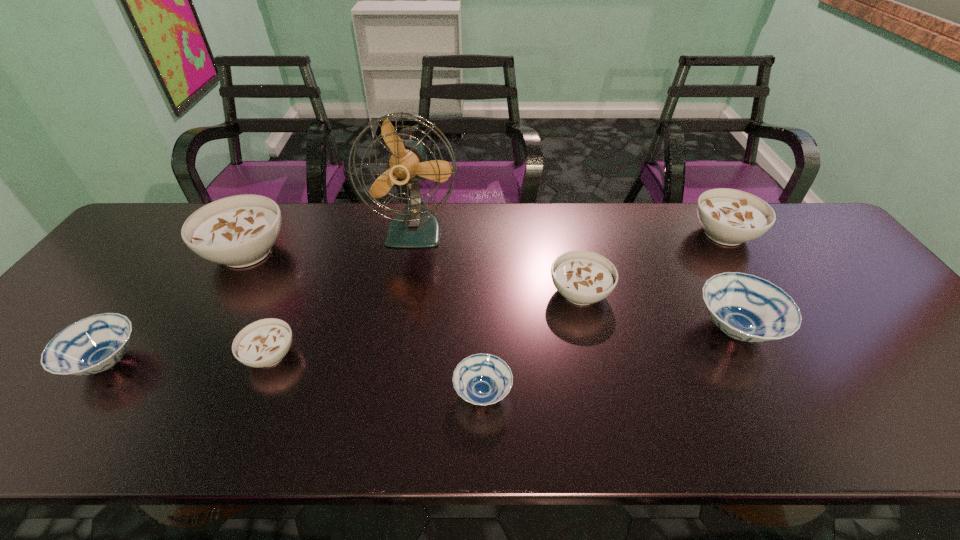
In order to click on free space between the smallest blue soup bowl and the fifth object from right to left in this screenshot , I will do `click(449, 312)`.

Where is `vacant point located between the second tallest object and the smallest blue soup bowl`? The height and width of the screenshot is (540, 960). vacant point located between the second tallest object and the smallest blue soup bowl is located at coordinates (365, 322).

Locate an element on the screen. Image resolution: width=960 pixels, height=540 pixels. free space between the second smallest blue soup bowl and the seventh shortest object is located at coordinates (177, 307).

In order to click on free space that is in between the fifth object from left to right and the rightmost white soup bowl in this screenshot , I will do `click(603, 314)`.

Where is `vacant area between the fourth soup bowl from right to left and the biggest blue soup bowl`? vacant area between the fourth soup bowl from right to left and the biggest blue soup bowl is located at coordinates (609, 361).

Find the location of a particular element. The height and width of the screenshot is (540, 960). unoccupied position between the biggest blue soup bowl and the sixth object from right to left is located at coordinates (503, 342).

This screenshot has width=960, height=540. In order to click on free point between the leftmost blue soup bowl and the third soup bowl from left to right in this screenshot , I will do `click(189, 359)`.

You are a GUI agent. You are given a task and a screenshot of the screen. Output one action in this format:
    pyautogui.click(x=<x>, y=<y>)
    Task: Click on the object that is the fourth closest one to the rightmost blue soup bowl
    The image size is (960, 540).
    Given the screenshot: What is the action you would take?
    pyautogui.click(x=416, y=227)

Find the location of a particular element. object that ranks as the closest to the sixth object from right to left is located at coordinates (238, 231).

Locate which soup bowl is the closest to the tallest soup bowl. Please provide its 2D coordinates. Your answer should be formatted as a tuple, i.e. [(x, y)], where the tuple contains the x and y coordinates of a point satisfying the conditions above.

[(94, 344)]